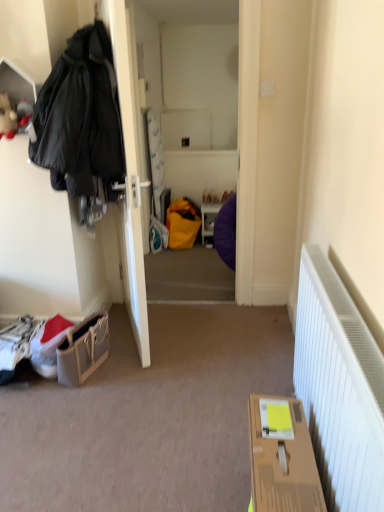
Question: Is cardboard box at lower right taller or shorter than matte black coat at left?

Choices:
 (A) tall
 (B) short

Answer: (B)

Question: From a real-world perspective, is cardboard box at lower right positioned above or below matte black coat at left?

Choices:
 (A) below
 (B) above

Answer: (A)

Question: Estimate the real-world distances between objects in this image. Which object is closer to the leather textured handbag at lower left?

Choices:
 (A) matte purple bean bag at center
 (B) matte black coat at left
 (C) fluffy plush toy at upper left
 (D) matte white door at left
 (E) cardboard box at lower right

Answer: (B)

Question: Considering the real-world distances, which object is farthest from the matte purple bean bag at center?

Choices:
 (A) matte black coat at left
 (B) matte white door at left
 (C) cardboard box at lower right
 (D) fluffy plush toy at upper left
 (E) leather textured handbag at lower left

Answer: (C)